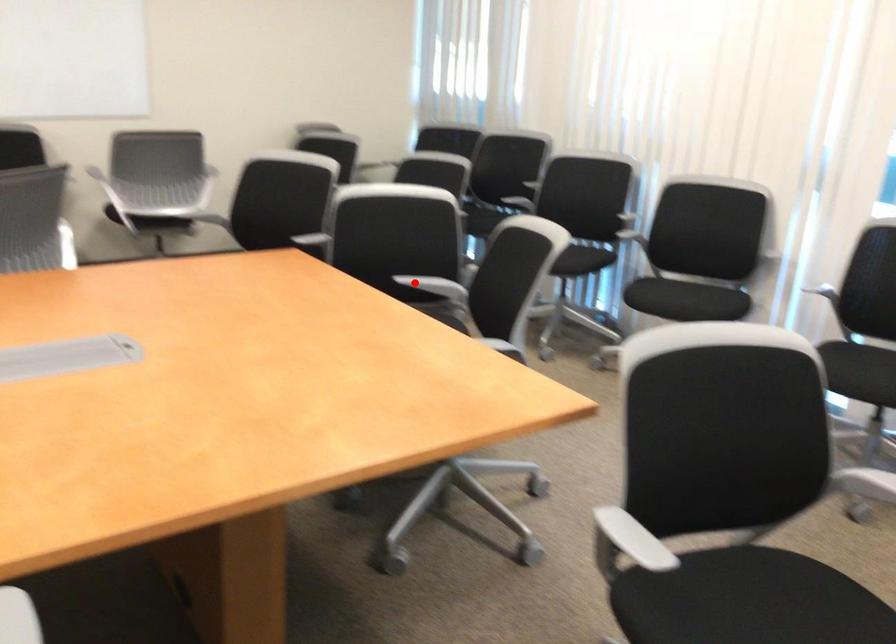
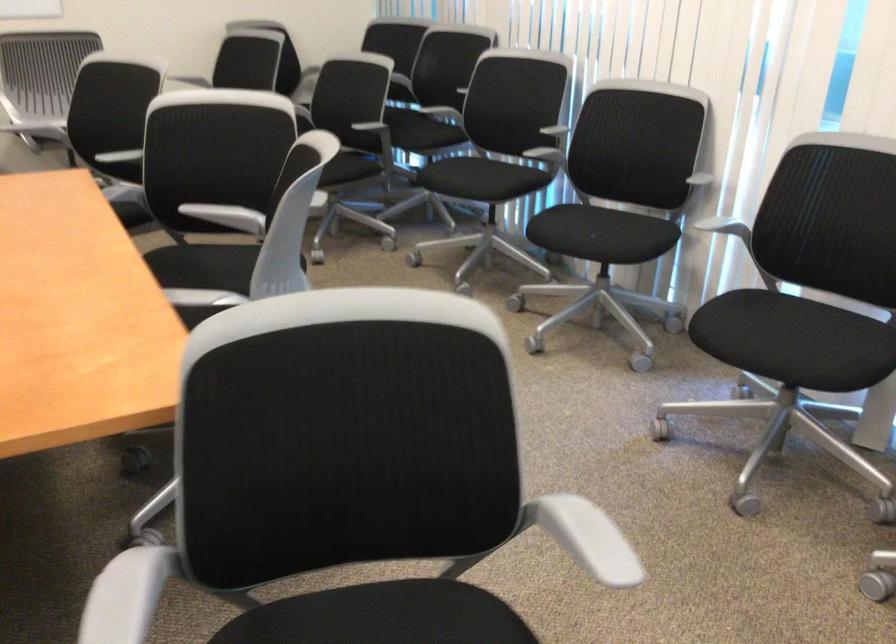
Locate, in the second image, the point that corresponds to the highlighted location in the first image.

(208, 212)